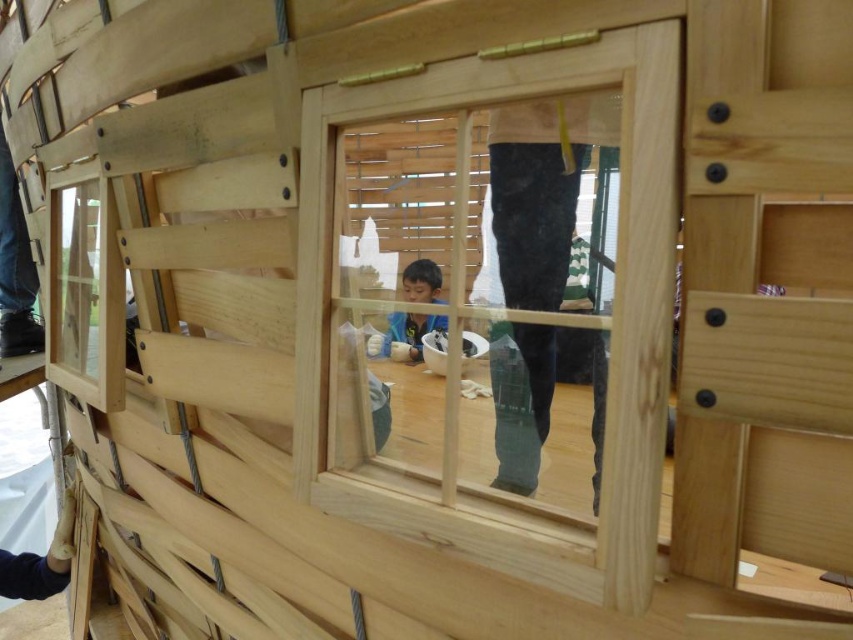
Question: Is clear glass window at center bigger than smooth wooden boy at center?

Choices:
 (A) yes
 (B) no

Answer: (A)

Question: Can you confirm if clear glass window at center is positioned above smooth wooden boy at center?

Choices:
 (A) no
 (B) yes

Answer: (B)

Question: Observing the image, what is the correct spatial positioning of clear glass window at center in reference to smooth wooden boy at center?

Choices:
 (A) left
 (B) right

Answer: (B)

Question: Among these objects, which one is farthest from the camera?

Choices:
 (A) clear glass window at center
 (B) smooth wooden boy at center

Answer: (B)